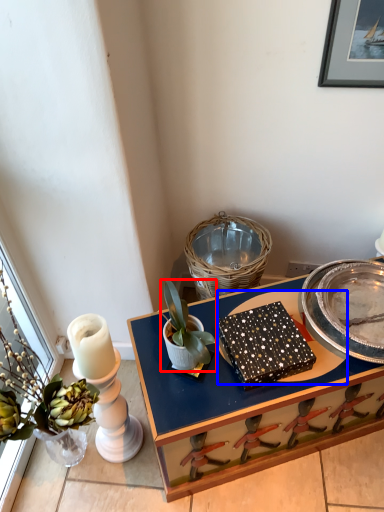
Question: Which object appears closest to the camera in this image, houseplant (highlighted by a red box) or glass plate (highlighted by a blue box)?

Choices:
 (A) houseplant
 (B) glass plate

Answer: (A)